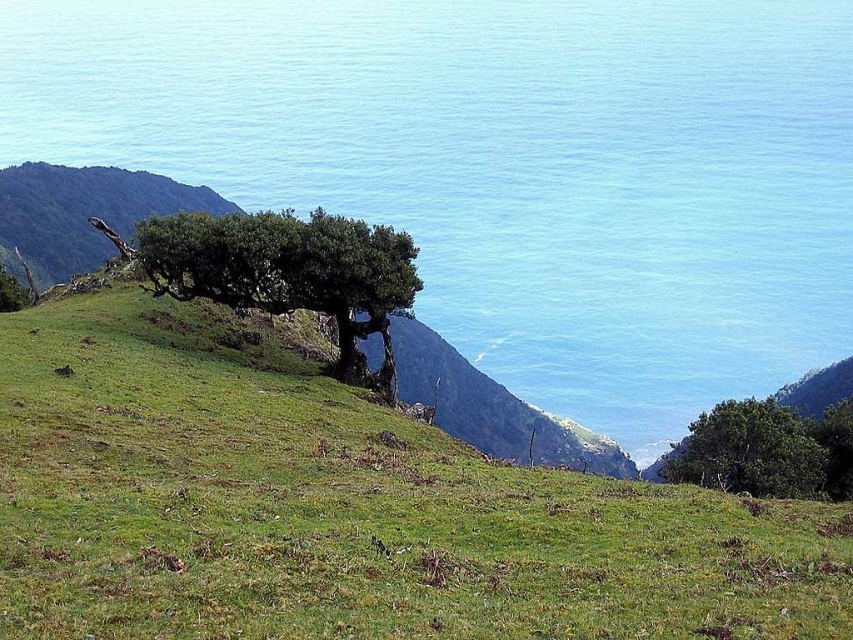
Between point (428, 515) and point (288, 216), which one is positioned behind?

The point (288, 216) is behind.

Which is more to the right, green grassy hillside at center or green leafy tree at center?

green leafy tree at center is more to the right.

Measure the distance between point (x=640, y=508) and camera.

Point (x=640, y=508) and camera are 19.34 meters apart from each other.

Identify the location of green grassy hillside at center. (345, 512).

Between point (607, 3) and point (799, 420), which one is positioned in front?

Positioned in front is point (799, 420).

Who is shorter, blue water at upper center or green leafy tree at lower right?

green leafy tree at lower right

Between point (599, 340) and point (698, 442), which one is positioned in front?

Point (698, 442) is in front.

The image size is (853, 640). Identify the location of blue water at upper center. (505, 166).

Consider the image. Does blue water at upper center appear on the left side of green grassy hill at upper left?

Answer: Incorrect, blue water at upper center is not on the left side of green grassy hill at upper left.

Who is more forward, [746,77] or [102,179]?

Point [102,179] is more forward.

Is point (171, 141) positioned behind point (106, 196)?

Yes, point (171, 141) is farther from viewer.

This screenshot has height=640, width=853. I want to click on blue water at upper center, so click(505, 166).